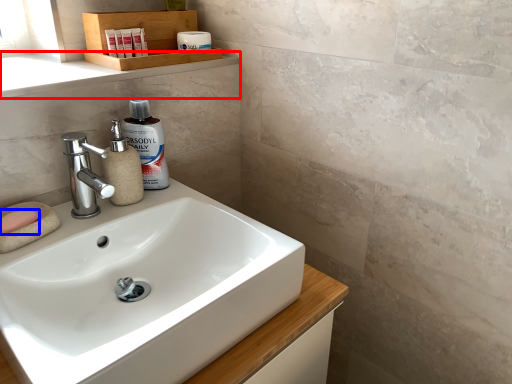
Question: Which object is closer to the camera taking this photo, window sill (highlighted by a red box) or soap (highlighted by a blue box)?

Choices:
 (A) window sill
 (B) soap

Answer: (B)